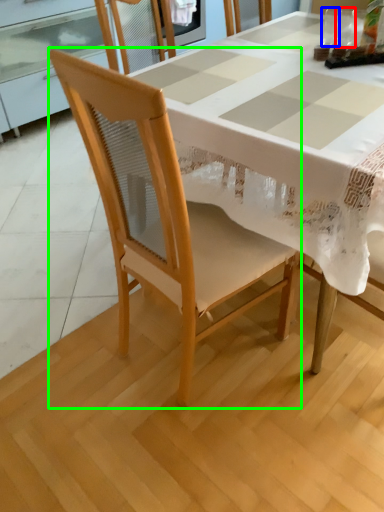
Question: Based on their relative distances, which object is farther from tableware (highlighted by a red box)? Choose from tableware (highlighted by a blue box) and chair (highlighted by a green box).

Choices:
 (A) tableware
 (B) chair

Answer: (B)